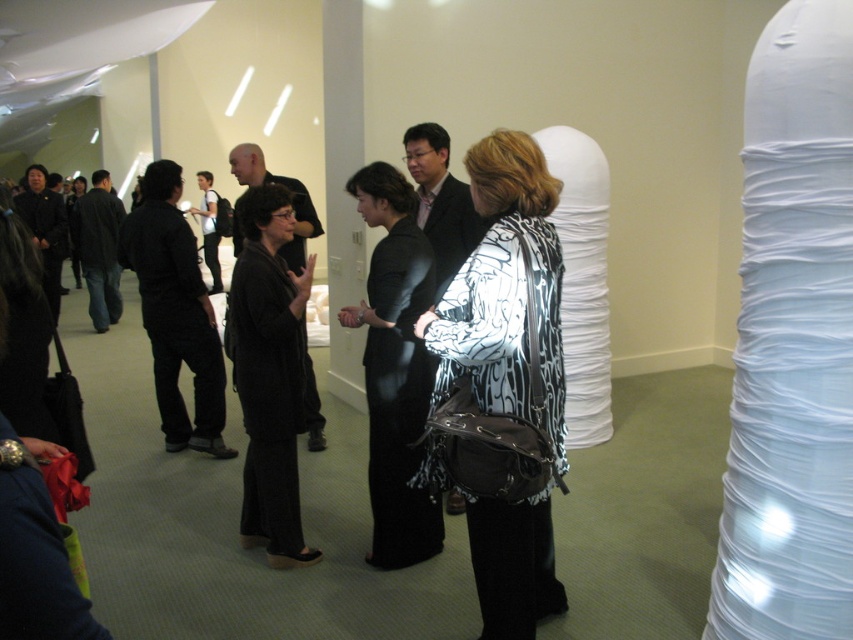
Is point (526, 612) positioned behind point (431, 547)?

No.

Who is lower down, printed fabric jacket at center or black silk dress at center?

printed fabric jacket at center is lower down.

Is point (552, 314) closer to viewer compared to point (403, 541)?

Yes, it is.

Locate an element on the screen. The width and height of the screenshot is (853, 640). printed fabric jacket at center is located at coordinates (502, 387).